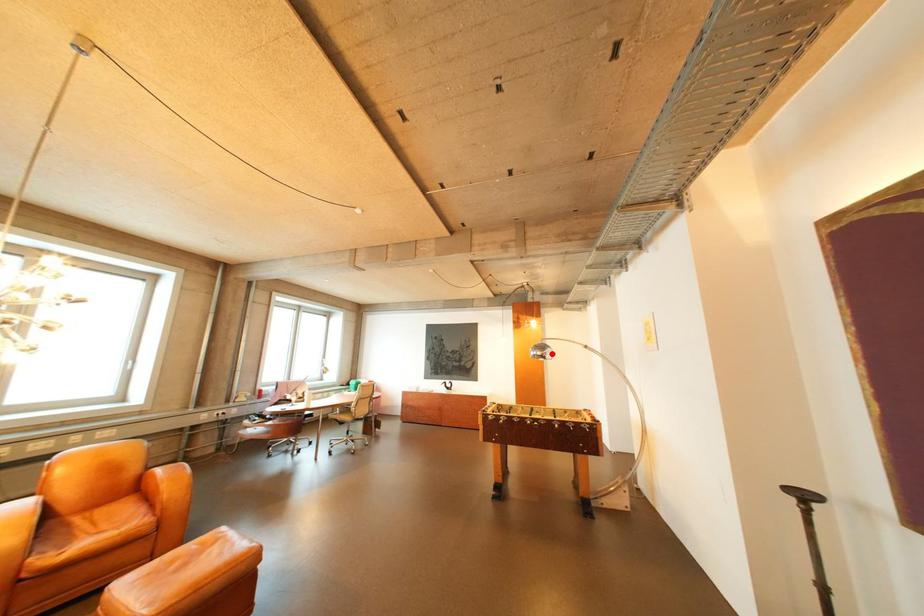
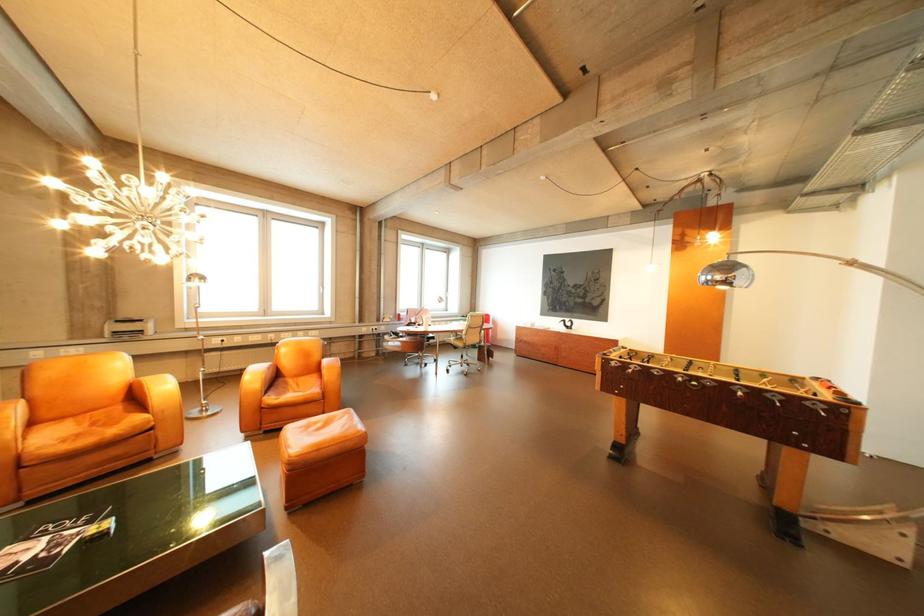
Find the pixel in the second image that matches the highlighted location in the first image.

(732, 278)